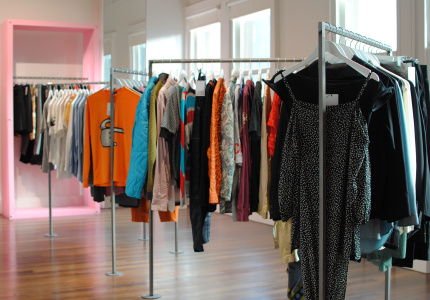
Where is `clothe hangers`? This screenshot has height=300, width=430. clothe hangers is located at coordinates (331, 45), (366, 52), (248, 73), (120, 82).